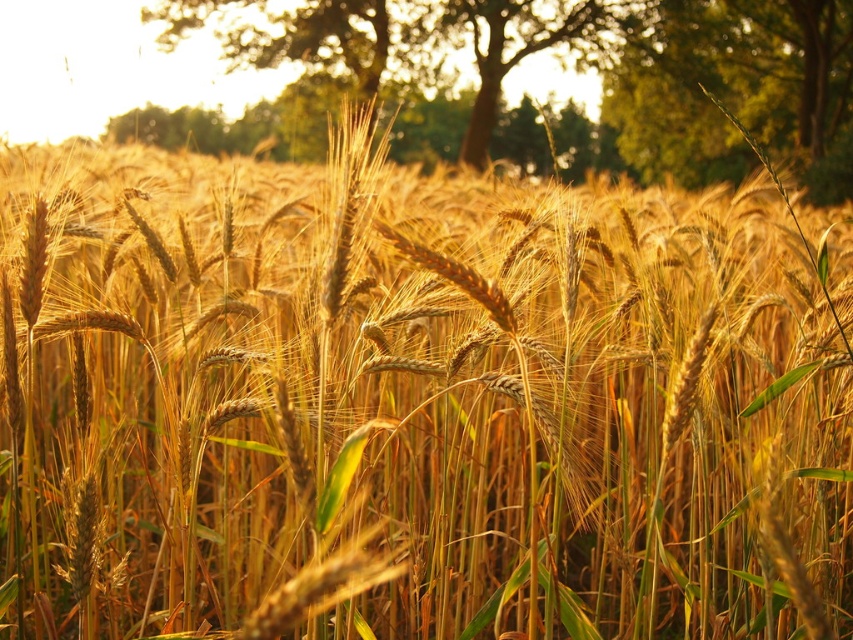
Between green leafy tree at upper center and green leafy tree at upper right, which one is positioned higher?

green leafy tree at upper right is higher up.

Is point (793, 3) behind point (676, 106)?

Yes, point (793, 3) is farther from viewer.

Who is more distant from viewer, (647, 60) or (842, 180)?

The point (647, 60) is more distant.

Where is `green leafy tree at upper center`? green leafy tree at upper center is located at coordinates (735, 90).